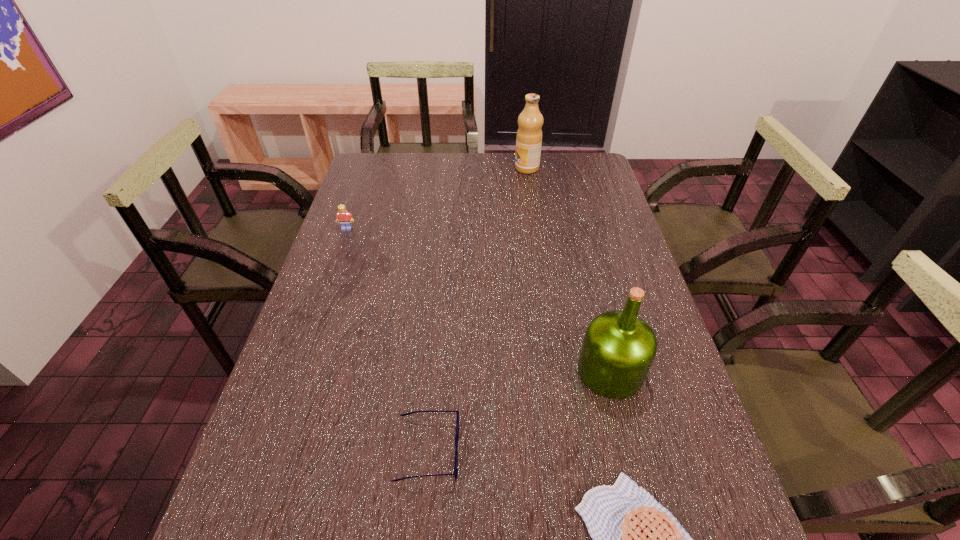
Identify the location of vacant space that satisfies the following two spatial constraints: 1. on the label of the nearer olive oil; 2. on the right side of the farther olive oil. The height and width of the screenshot is (540, 960). (557, 371).